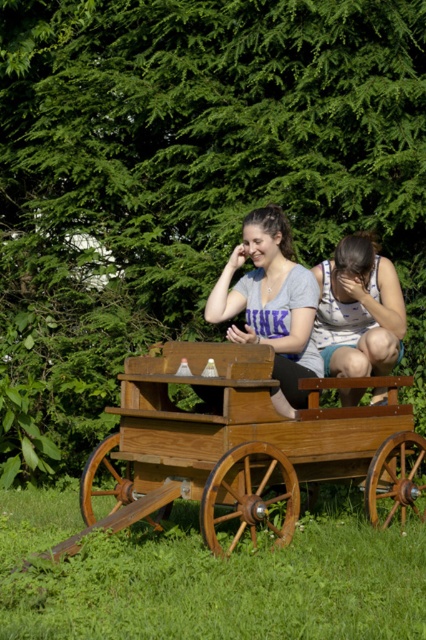
Can you confirm if wooden wagon at center is positioned below striped cotton shirt at center?

Yes.

In the scene shown: Can you confirm if wooden wagon at center is thinner than striped cotton shirt at center?

No.

This screenshot has width=426, height=640. I want to click on wooden wagon at center, so click(244, 449).

Who is positioned more to the right, matte gray shirt at center or striped cotton shirt at center?

striped cotton shirt at center

Does matte gray shirt at center come in front of striped cotton shirt at center?

Yes, matte gray shirt at center is closer to the viewer.

Between point (302, 326) and point (360, 298), which one is positioned in front?

Point (302, 326) is in front.

Find the location of a particular element. This screenshot has height=640, width=426. matte gray shirt at center is located at coordinates (270, 300).

From the picture: Measure the distance between green grass at lower center and wooden wagon at center.

green grass at lower center is 20.37 inches away from wooden wagon at center.

Who is shorter, green grass at lower center or wooden wagon at center?

Standing shorter between the two is green grass at lower center.

Is point (195, 570) positioned after point (316, 461)?

That is False.

Where is `green grass at lower center`? This screenshot has height=640, width=426. green grass at lower center is located at coordinates (209, 577).